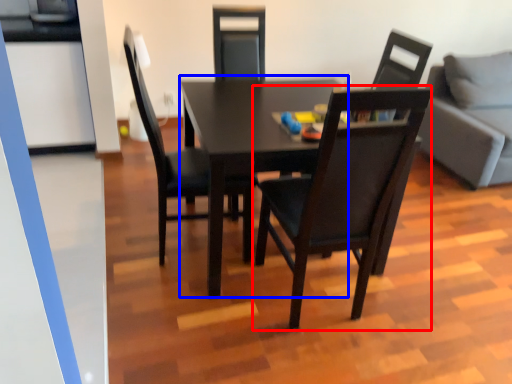
Question: Which object appears farthest to the camera in this image, chair (highlighted by a red box) or table (highlighted by a blue box)?

Choices:
 (A) chair
 (B) table

Answer: (B)